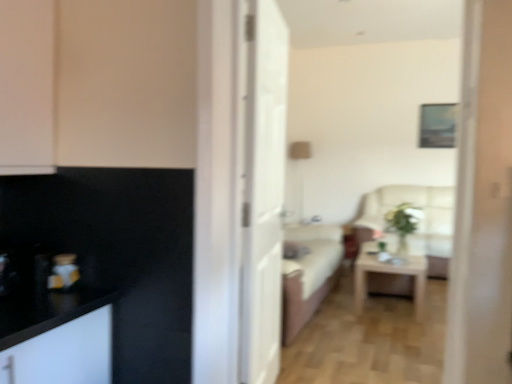
Locate an element on the screen. The image size is (512, 384). white glossy door at center is located at coordinates (263, 192).

Describe the element at coordinates (420, 220) in the screenshot. I see `beige fabric armchair at center` at that location.

The image size is (512, 384). I want to click on black matte cabinet at upper left, so click(27, 87).

What are the coordinates of `armchair behind the white glossy door at center` in the screenshot? It's located at (420, 220).

Could you tell me if white glossy door at center is facing beige fabric armchair at center?

No, white glossy door at center is not aimed at beige fabric armchair at center.

Is white glossy door at center shorter than beige fabric armchair at center?

No, white glossy door at center is not shorter than beige fabric armchair at center.

From a real-world perspective, is white glossy door at center under beige fabric armchair at center?

No.

Can you confirm if black matte cabinet at upper left is positioned to the left of white glossy door at center?

Yes.

Is black matte cabinet at upper left oriented away from white glossy door at center?

No, black matte cabinet at upper left is not facing away from white glossy door at center.

Can you tell me how much black matte cabinet at upper left and white glossy door at center differ in facing direction?

black matte cabinet at upper left and white glossy door at center are facing 8.05 degrees away from each other.

Is point (240, 340) positioned in front of point (72, 265)?

That is False.

Looking at this image, does white glossy door at center come in front of metallic gold vase at left?

No, white glossy door at center is behind metallic gold vase at left.

Considering the relative sizes of white glossy door at center and metallic gold vase at left in the image provided, is white glossy door at center taller than metallic gold vase at left?

Yes, white glossy door at center is taller than metallic gold vase at left.

Would you say white glossy door at center is a long distance from metallic gold vase at left?

white glossy door at center is actually quite close to metallic gold vase at left.

Is metallic gold vase at left oriented towards beige fabric armchair at center?

No, metallic gold vase at left does not turn towards beige fabric armchair at center.

Does metallic gold vase at left have a lesser width compared to beige fabric armchair at center?

Indeed, metallic gold vase at left has a lesser width compared to beige fabric armchair at center.

Is metallic gold vase at left positioned far away from beige fabric armchair at center?

metallic gold vase at left is positioned a significant distance from beige fabric armchair at center.

Based on the photo, from a real-world perspective, between metallic gold vase at left and beige fabric armchair at center, who is vertically higher?

metallic gold vase at left.

Which is less distant, [10,69] or [59,268]?

The point [10,69] is in front.

From the picture: Considering the relative sizes of black matte cabinet at upper left and metallic gold vase at left in the image provided, is black matte cabinet at upper left bigger than metallic gold vase at left?

Yes, black matte cabinet at upper left is bigger than metallic gold vase at left.

From a real-world perspective, who is located higher, black matte cabinet at upper left or metallic gold vase at left?

In real-world perspective, black matte cabinet at upper left is above.

Would you say black matte cabinet at upper left is a long distance from metallic gold vase at left?

No, there isn't a large distance between black matte cabinet at upper left and metallic gold vase at left.

From the image's perspective, which object appears higher, beige fabric armchair at center or white glossy door at center?

From the image's view, white glossy door at center is above.

Consider the image. Which object is thinner, beige fabric armchair at center or white glossy door at center?

Thinner between the two is white glossy door at center.

Is point (438, 272) less distant than point (266, 362)?

No, (438, 272) is behind (266, 362).

Which is more to the right, beige fabric armchair at center or white glossy door at center?

Positioned to the right is beige fabric armchair at center.

Is black matte cabinet at upper left positioned before light wood/wooden table at center?

Yes, black matte cabinet at upper left is closer to the camera.

Would you say light wood/wooden table at center is part of black matte cabinet at upper left's contents?

Actually, light wood/wooden table at center is outside black matte cabinet at upper left.

Is point (10, 111) closer or farther from the camera than point (417, 293)?

Point (10, 111).

Does black matte cabinet at upper left have a greater height compared to light wood/wooden table at center?

Yes.

Locate an element on the screen. door in front of the beige fabric armchair at center is located at coordinates (263, 192).

Identify the location of door that appears below the black matte cabinet at upper left (from a real-world perspective). (263, 192).

Considering their positions, is black matte cabinet at upper left positioned closer to light wood/wooden table at center than beige fabric armchair at center?

Based on the image, beige fabric armchair at center appears to be nearer to light wood/wooden table at center.

Based on their spatial positions, is light wood/wooden table at center or beige fabric armchair at center further from metallic gold vase at left?

Among the two, beige fabric armchair at center is located further to metallic gold vase at left.

Considering their positions, is black matte cabinet at upper left positioned closer to white glossy door at center than light wood/wooden table at center?

black matte cabinet at upper left lies closer to white glossy door at center than the other object.

When comparing their distances from white glossy door at center, does beige fabric armchair at center or metallic gold vase at left seem closer?

metallic gold vase at left is positioned closer to the anchor white glossy door at center.

In the scene shown: From the image, which object appears to be farther from beige fabric armchair at center, light wood/wooden table at center or black matte cabinet at upper left?

black matte cabinet at upper left is positioned further to the anchor beige fabric armchair at center.

Estimate the real-world distances between objects in this image. Which object is further from black matte cabinet at upper left, beige fabric armchair at center or metallic gold vase at left?

beige fabric armchair at center.

Considering their positions, is beige fabric armchair at center positioned further to light wood/wooden table at center than white glossy door at center?

beige fabric armchair at center lies further to light wood/wooden table at center than the other object.

Looking at the image, which one is located further to white glossy door at center, metallic gold vase at left or beige fabric armchair at center?

The object further to white glossy door at center is beige fabric armchair at center.

The width and height of the screenshot is (512, 384). What are the coordinates of `table between white glossy door at center and beige fabric armchair at center in the front-back direction` in the screenshot? It's located at (390, 273).

Image resolution: width=512 pixels, height=384 pixels. I want to click on door between black matte cabinet at upper left and light wood/wooden table at center in the front-back direction, so tap(263, 192).

You are a GUI agent. You are given a task and a screenshot of the screen. Output one action in this format:
    pyautogui.click(x=<x>, y=<y>)
    Task: Click on the door positioned between metallic gold vase at left and light wood/wooden table at center from near to far
    Image resolution: width=512 pixels, height=384 pixels.
    Given the screenshot: What is the action you would take?
    pyautogui.click(x=263, y=192)

Image resolution: width=512 pixels, height=384 pixels. I want to click on appliance between black matte cabinet at upper left and white glossy door at center, so click(x=63, y=272).